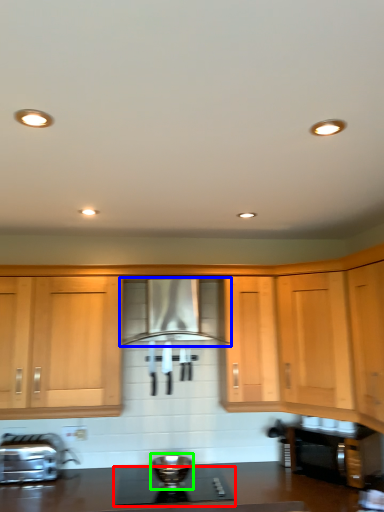
Question: Which object is positioned closest to gas stove (highlighted by a red box)? Select from home appliance (highlighted by a blue box) and appliance (highlighted by a green box).

Choices:
 (A) home appliance
 (B) appliance

Answer: (B)